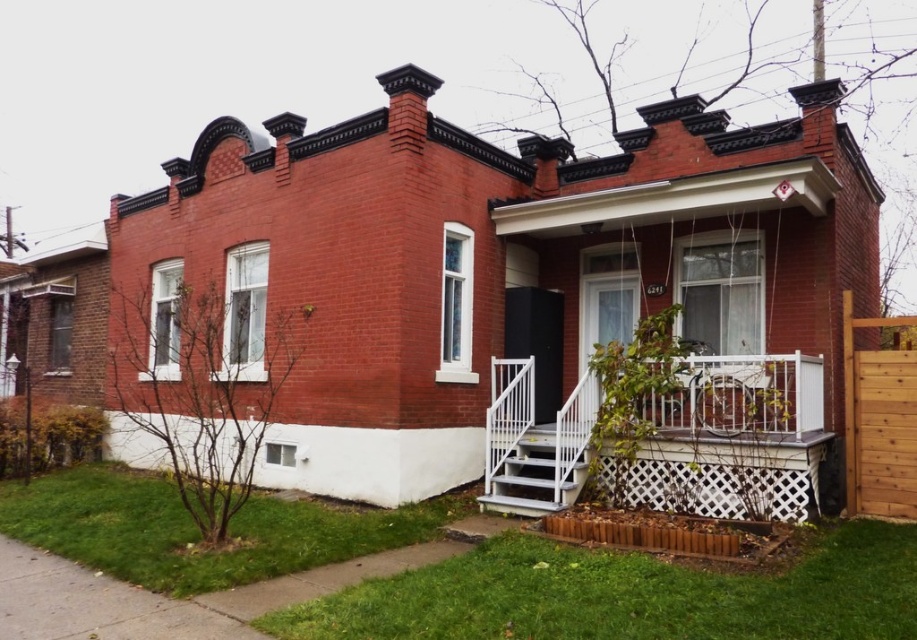
Is point (516, 480) positioned before point (547, 451)?

Yes, it is.

At what (x,y) coordinates should I click in order to perform the action: click on white lattice porch at center. Please return your answer as a coordinate pair (x, y). The image size is (917, 640). Looking at the image, I should click on (735, 438).

Locate an element on the screen. white lattice porch at center is located at coordinates (735, 438).